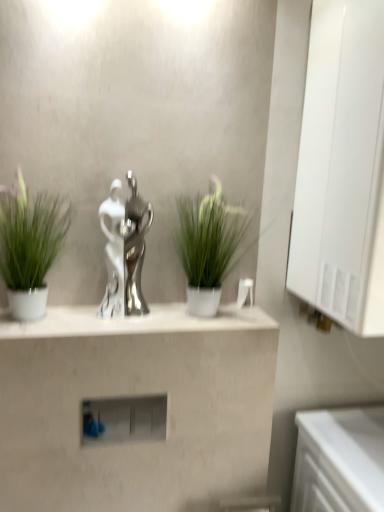
Locate an element on the screen. The image size is (384, 512). free point to the right of green matte plant at left, which is counted as the first houseplant, starting from the left is located at coordinates (102, 322).